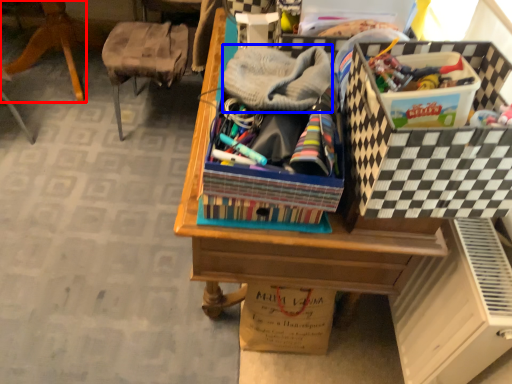
Question: Which point is closer to the camera, furniture (highlighted by a red box) or clothing (highlighted by a blue box)?

Choices:
 (A) furniture
 (B) clothing

Answer: (B)